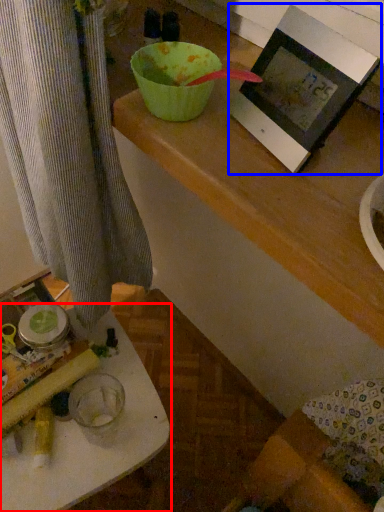
Question: Which object appears farthest to the camera in this image, table (highlighted by a red box) or picture frame (highlighted by a blue box)?

Choices:
 (A) table
 (B) picture frame

Answer: (A)